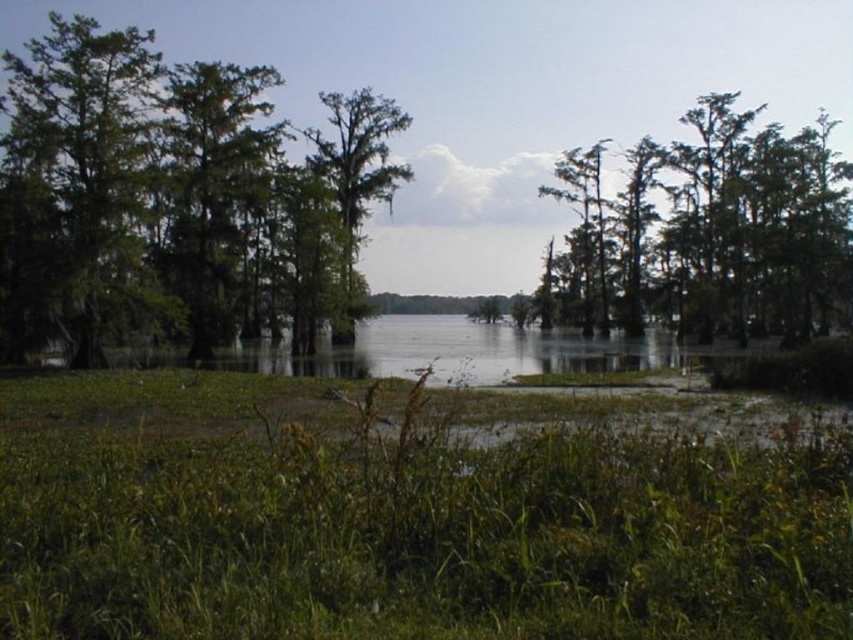
Question: Does green grassy at lower center have a greater width compared to green mossy tree at center?

Choices:
 (A) yes
 (B) no

Answer: (B)

Question: Estimate the real-world distances between objects in this image. Which object is closer to the green mossy tree at left?

Choices:
 (A) green mossy tree at center
 (B) green mossy trees at left

Answer: (B)

Question: Among these points, which one is farthest from the camera?

Choices:
 (A) (7, 76)
 (B) (576, 156)

Answer: (B)

Question: Considering the relative positions of green grassy at lower center and green mossy tree at center in the image provided, where is green grassy at lower center located with respect to green mossy tree at center?

Choices:
 (A) below
 (B) above

Answer: (A)

Question: Is green mossy trees at right positioned in front of green mossy tree at left?

Choices:
 (A) no
 (B) yes

Answer: (A)

Question: Which point is farther to the camera?

Choices:
 (A) (103, 246)
 (B) (99, 184)

Answer: (B)